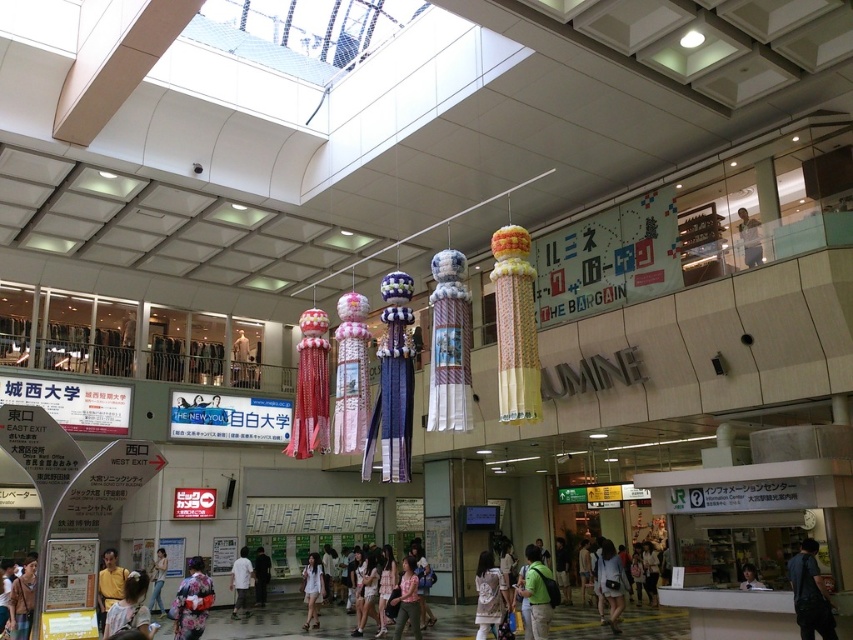
Question: Does yellow cotton kimono at lower left appear on the right side of light blue jeans at upper right?

Choices:
 (A) no
 (B) yes

Answer: (A)

Question: Among these objects, which one is farthest from the camera?

Choices:
 (A) white floral dress at center
 (B) green backpack at center

Answer: (A)

Question: Which object is positioned closest to the matte white shirt at center?

Choices:
 (A) silky kimono at lower left
 (B) yellow cotton kimono at lower left

Answer: (A)

Question: Can you confirm if white floral dress at center is wider than pink fabric dress at center?

Choices:
 (A) yes
 (B) no

Answer: (B)

Question: Can you confirm if matte white shirt at lower center is positioned to the left of pink fabric dress at center?

Choices:
 (A) yes
 (B) no

Answer: (B)

Question: Which object appears farthest from the camera in this image?

Choices:
 (A) matte white shirt at center
 (B) white floral dress at center
 (C) white cotton dress at center

Answer: (C)